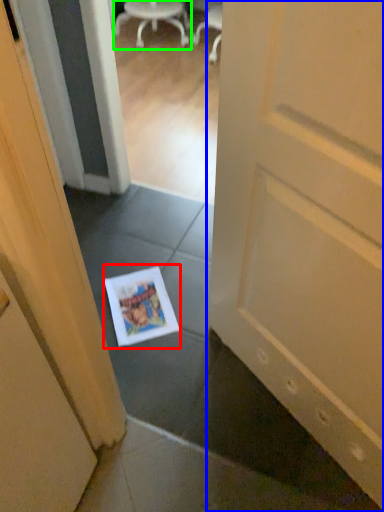
Question: Which object is positioned farthest from magazine (highlighted by a red box)? Select from door (highlighted by a blue box) and chair (highlighted by a green box).

Choices:
 (A) door
 (B) chair

Answer: (B)